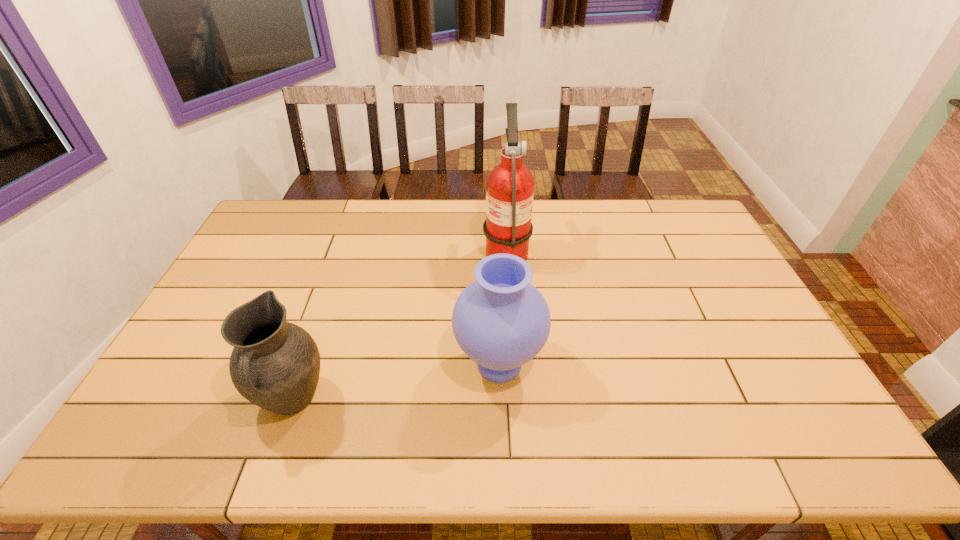
The width and height of the screenshot is (960, 540). I want to click on free area in between the leftmost object and the vase, so click(x=396, y=382).

Locate an element on the screen. The width and height of the screenshot is (960, 540). free area in between the pitcher and the fire extinguisher is located at coordinates (399, 324).

At what (x,y) coordinates should I click in order to perform the action: click on vacant space that is in between the pitcher and the vase. Please return your answer as a coordinate pair (x, y). Looking at the image, I should click on (396, 382).

Find the location of a particular element. free space between the vase and the leftmost object is located at coordinates (396, 382).

The width and height of the screenshot is (960, 540). Identify the location of empty space between the vase and the pitcher. point(396,382).

Identify which object is located as the second nearest to the vase. Please provide its 2D coordinates. Your answer should be formatted as a tuple, i.e. [(x, y)], where the tuple contains the x and y coordinates of a point satisfying the conditions above.

[(275, 364)]

Where is `the second closest object relative to the farthest object`? Image resolution: width=960 pixels, height=540 pixels. the second closest object relative to the farthest object is located at coordinates (275, 364).

You are a GUI agent. You are given a task and a screenshot of the screen. Output one action in this format:
    pyautogui.click(x=<x>, y=<y>)
    Task: Click on the vacant region that satisfies the following two spatial constraints: 1. on the nozzle and handle of the farthest object; 2. on the side of the pitcher with the handle
    This screenshot has height=540, width=960.
    Given the screenshot: What is the action you would take?
    pyautogui.click(x=516, y=400)

Find the location of a particular element. Image resolution: width=960 pixels, height=540 pixels. free space that satisfies the following two spatial constraints: 1. on the nozzle and handle of the farthest object; 2. on the side of the pitcher with the handle is located at coordinates (516, 400).

What are the coordinates of `free spot that satisfies the following two spatial constraints: 1. on the nozzle and handle of the fire extinguisher; 2. on the side of the pitcher with the handle` in the screenshot? It's located at (516, 400).